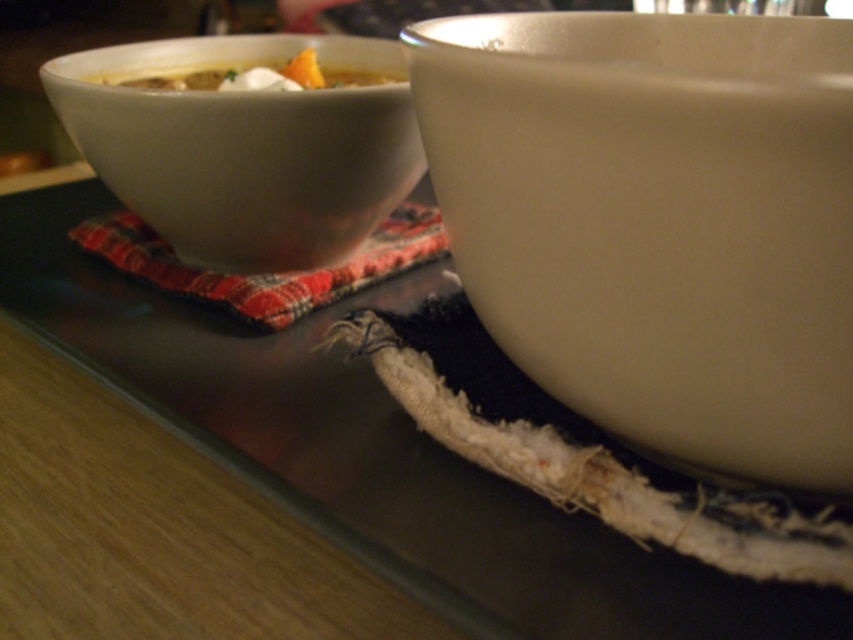
Is matte white bowl at left taller than yellow matte soup at upper left?

Correct, matte white bowl at left is much taller as yellow matte soup at upper left.

Can you confirm if matte white bowl at left is smaller than yellow matte soup at upper left?

No, matte white bowl at left is not smaller than yellow matte soup at upper left.

Locate an element on the screen. The height and width of the screenshot is (640, 853). matte white bowl at left is located at coordinates (245, 147).

Where is `matte white bowl at left`? matte white bowl at left is located at coordinates (245, 147).

Can you confirm if matte white bowl at center is shorter than matte white bowl at left?

Indeed, matte white bowl at center has a lesser height compared to matte white bowl at left.

Where is `matte white bowl at center`? matte white bowl at center is located at coordinates (659, 224).

Is matte white bowl at center thinner than red plaid cloth at upper left?

Indeed, matte white bowl at center has a lesser width compared to red plaid cloth at upper left.

The width and height of the screenshot is (853, 640). I want to click on matte white bowl at center, so click(x=659, y=224).